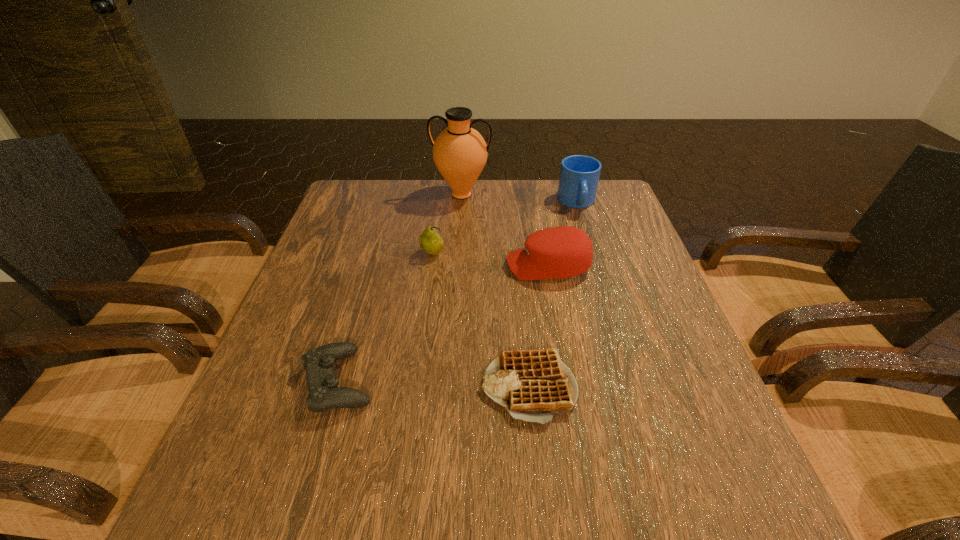
Locate an element on the screen. the tallest object is located at coordinates (460, 153).

At what (x,y) coordinates should I click in order to perform the action: click on the second tallest object. Please return your answer as a coordinate pair (x, y). The width and height of the screenshot is (960, 540). Looking at the image, I should click on (579, 175).

This screenshot has height=540, width=960. I want to click on cap, so click(x=560, y=252).

Find the location of a particular element. This screenshot has height=540, width=960. pear is located at coordinates (430, 241).

Image resolution: width=960 pixels, height=540 pixels. In order to click on the leftmost object in this screenshot , I will do `click(324, 394)`.

This screenshot has width=960, height=540. I want to click on control, so click(324, 394).

The width and height of the screenshot is (960, 540). In order to click on waffle in this screenshot , I will do `click(533, 385)`.

Where is `free location located 0.100m on the right of the pitcher`? free location located 0.100m on the right of the pitcher is located at coordinates (523, 194).

I want to click on vacant space located on the side of the mug with the handle, so (607, 298).

The image size is (960, 540). Find the location of `vacant space located on the front-facing side of the cap`. vacant space located on the front-facing side of the cap is located at coordinates (443, 266).